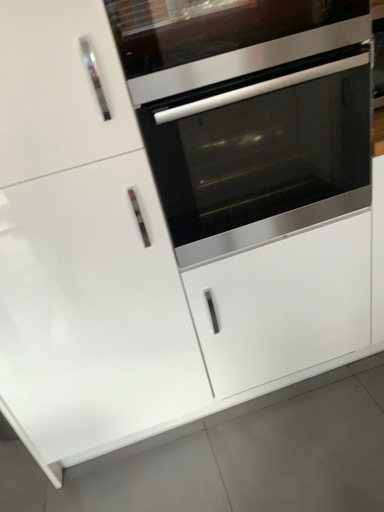
Question: Is stainless steel oven at center far from white glossy drawer at center?

Choices:
 (A) yes
 (B) no

Answer: (B)

Question: From a real-world perspective, is stainless steel oven at center under white glossy drawer at center?

Choices:
 (A) no
 (B) yes

Answer: (A)

Question: Is stainless steel oven at center with white glossy drawer at center?

Choices:
 (A) no
 (B) yes

Answer: (A)

Question: Would you say stainless steel oven at center is outside white glossy drawer at center?

Choices:
 (A) no
 (B) yes

Answer: (B)

Question: Is stainless steel oven at center facing towards white glossy drawer at center?

Choices:
 (A) no
 (B) yes

Answer: (A)

Question: Considering the positions of point (49, 284) and point (140, 37), is point (49, 284) closer or farther from the camera than point (140, 37)?

Choices:
 (A) closer
 (B) farther

Answer: (B)

Question: Is white glossy door at center wider or thinner than stainless steel oven at center?

Choices:
 (A) wide
 (B) thin

Answer: (A)

Question: Considering the positions of white glossy door at center and stainless steel oven at center in the image, is white glossy door at center taller or shorter than stainless steel oven at center?

Choices:
 (A) tall
 (B) short

Answer: (A)

Question: From a real-world perspective, relative to stainless steel oven at center, is white glossy door at center vertically above or below?

Choices:
 (A) below
 (B) above

Answer: (A)

Question: Considering the positions of point (292, 150) and point (152, 325), is point (292, 150) closer or farther from the camera than point (152, 325)?

Choices:
 (A) farther
 (B) closer

Answer: (B)

Question: In the image, is stainless steel oven at center on the left side or the right side of white glossy door at center?

Choices:
 (A) left
 (B) right

Answer: (B)

Question: In the image, is stainless steel oven at center positioned in front of or behind white glossy door at center?

Choices:
 (A) behind
 (B) front

Answer: (A)

Question: From their relative heights in the image, would you say stainless steel oven at center is taller or shorter than white glossy door at center?

Choices:
 (A) short
 (B) tall

Answer: (A)

Question: Considering the positions of white glossy drawer at center and stainless steel oven at center in the image, is white glossy drawer at center taller or shorter than stainless steel oven at center?

Choices:
 (A) short
 (B) tall

Answer: (B)

Question: In the image, is white glossy drawer at center positioned in front of or behind stainless steel oven at center?

Choices:
 (A) front
 (B) behind

Answer: (B)